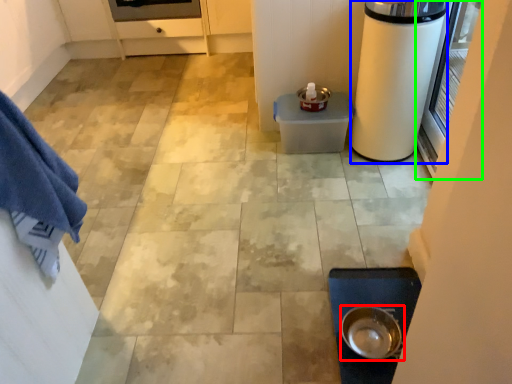
Question: Which is nearer to the kitchen appliance (highlighted by a red box)? appliance (highlighted by a blue box) or screen door (highlighted by a green box).

Choices:
 (A) appliance
 (B) screen door

Answer: (A)